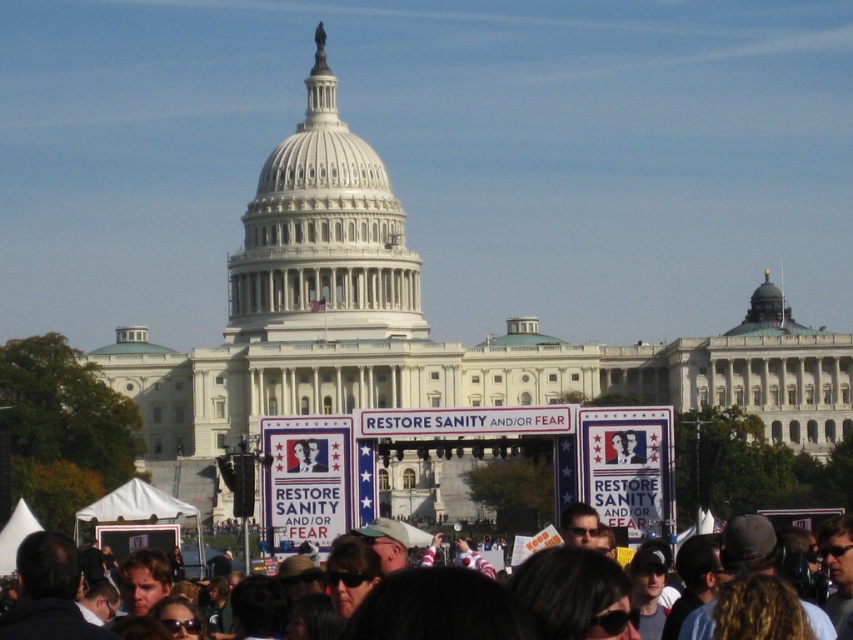
Is point (294, 490) positioned in front of point (682, 634)?

No, (294, 490) is behind (682, 634).

Does white paper sign at center have a lesser height compared to dark gray hair at lower center?

Indeed, white paper sign at center has a lesser height compared to dark gray hair at lower center.

Where is `white paper sign at center`? white paper sign at center is located at coordinates (305, 480).

The width and height of the screenshot is (853, 640). In order to click on white paper sign at center in this screenshot , I will do `click(305, 480)`.

This screenshot has width=853, height=640. Describe the element at coordinates (628, 467) in the screenshot. I see `blue fabric sign at center` at that location.

Does blue fabric sign at center have a larger size compared to dark gray hair at lower center?

Incorrect, blue fabric sign at center is not larger than dark gray hair at lower center.

Is point (639, 499) positioned in front of point (547, 618)?

No, (639, 499) is further to viewer.

At what (x,y) coordinates should I click in order to perform the action: click on blue fabric sign at center. Please return your answer as a coordinate pair (x, y). Looking at the image, I should click on (628, 467).

Who is positioned more to the left, blue fabric sign at center or white paper sign at center?

white paper sign at center

Is blue fabric sign at center closer to the viewer compared to white paper sign at center?

Yes, it is in front of white paper sign at center.

Which is behind, point (651, 452) or point (262, 442)?

The point (262, 442) is behind.

I want to click on blue fabric sign at center, so click(628, 467).